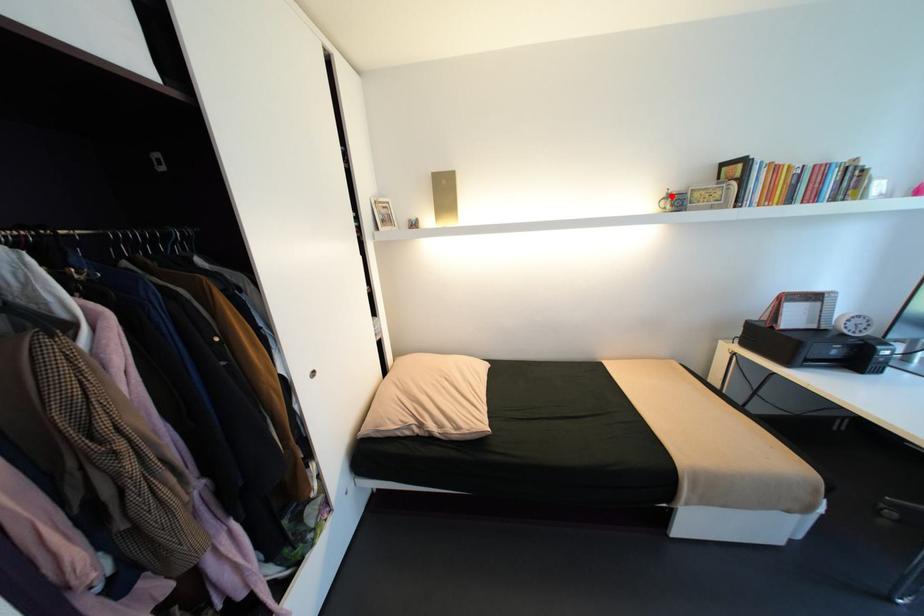
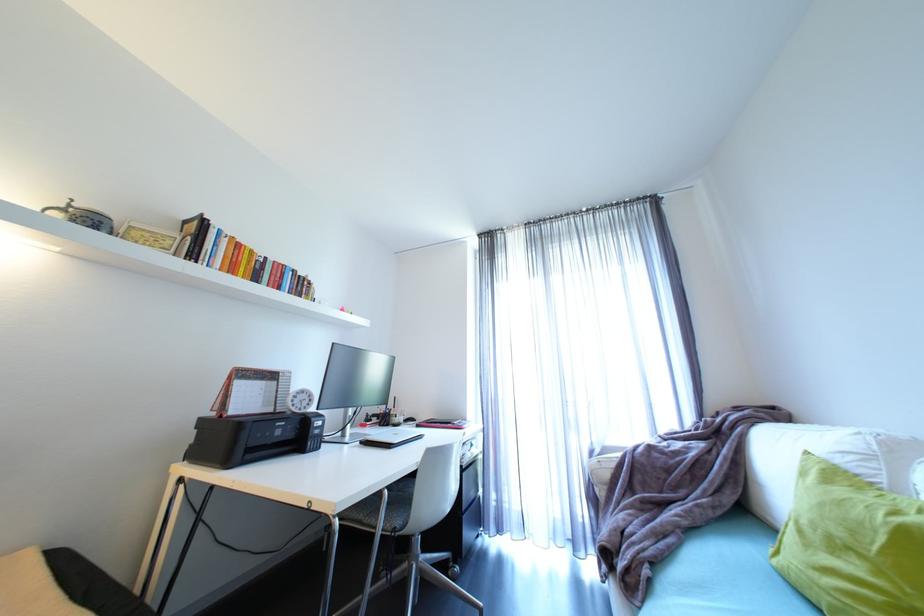
Find the pixel in the second image that matches the highlighted location in the first image.

(69, 206)